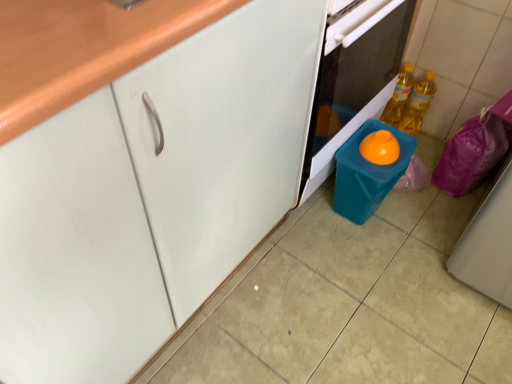
Question: Does blue plastic bin at lower center have a greater width compared to teal plastic container at lower right?

Choices:
 (A) no
 (B) yes

Answer: (B)

Question: From the image's perspective, would you say blue plastic bin at lower center is shown under teal plastic container at lower right?

Choices:
 (A) yes
 (B) no

Answer: (B)

Question: Is blue plastic bin at lower center facing towards teal plastic container at lower right?

Choices:
 (A) no
 (B) yes

Answer: (B)

Question: Does blue plastic bin at lower center have a smaller size compared to teal plastic container at lower right?

Choices:
 (A) no
 (B) yes

Answer: (A)

Question: Is blue plastic bin at lower center beside teal plastic container at lower right?

Choices:
 (A) yes
 (B) no

Answer: (B)

Question: In the image, is teal plastic container at lower right positioned in front of or behind white matte cabinet at center?

Choices:
 (A) behind
 (B) front

Answer: (A)

Question: From a real-world perspective, is teal plastic container at lower right above or below white matte cabinet at center?

Choices:
 (A) above
 (B) below

Answer: (B)

Question: In terms of size, does teal plastic container at lower right appear bigger or smaller than white matte cabinet at center?

Choices:
 (A) big
 (B) small

Answer: (B)

Question: Would you say teal plastic container at lower right is inside or outside white matte cabinet at center?

Choices:
 (A) inside
 (B) outside

Answer: (B)

Question: Would you say blue plastic bin at lower center is to the left or to the right of teal plastic container at lower right in the picture?

Choices:
 (A) left
 (B) right

Answer: (A)

Question: From their relative heights in the image, would you say blue plastic bin at lower center is taller or shorter than teal plastic container at lower right?

Choices:
 (A) short
 (B) tall

Answer: (B)

Question: Is point (373, 16) positioned closer to the camera than point (365, 210)?

Choices:
 (A) farther
 (B) closer

Answer: (B)

Question: From the image's perspective, is blue plastic bin at lower center positioned above or below teal plastic container at lower right?

Choices:
 (A) above
 (B) below

Answer: (A)

Question: Considering the positions of point (350, 142) and point (390, 13), is point (350, 142) closer or farther from the camera than point (390, 13)?

Choices:
 (A) farther
 (B) closer

Answer: (A)

Question: Considering their positions, is teal plastic container at lower right located in front of or behind blue plastic bin at lower center?

Choices:
 (A) front
 (B) behind

Answer: (B)